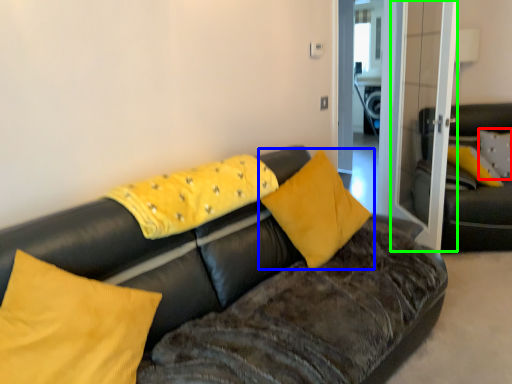
Question: Considering the real-world distances, which object is farthest from pillow (highlighted by a red box)? pillow (highlighted by a blue box) or glass door (highlighted by a green box)?

Choices:
 (A) pillow
 (B) glass door

Answer: (A)